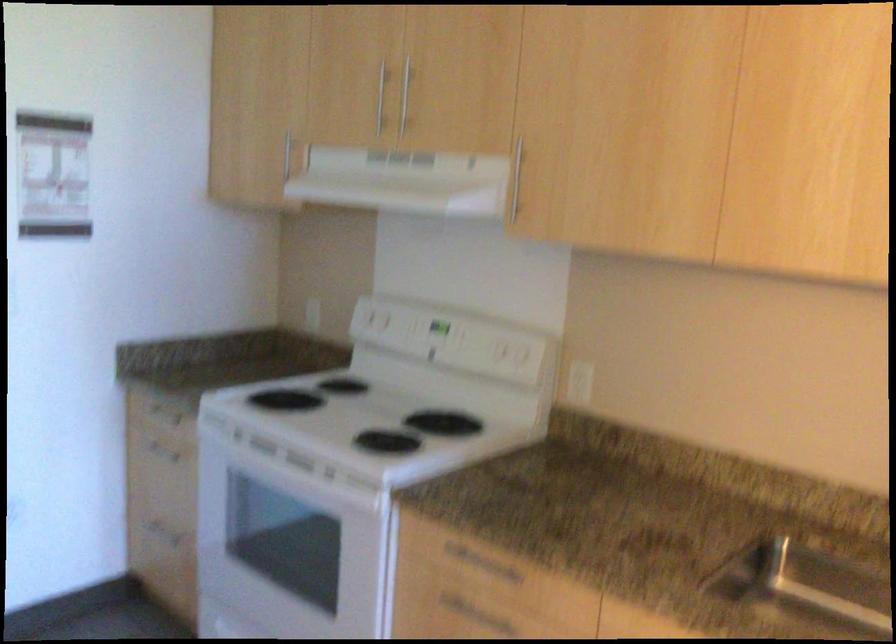
Identify the location of silver cabinet handle. (380, 98).